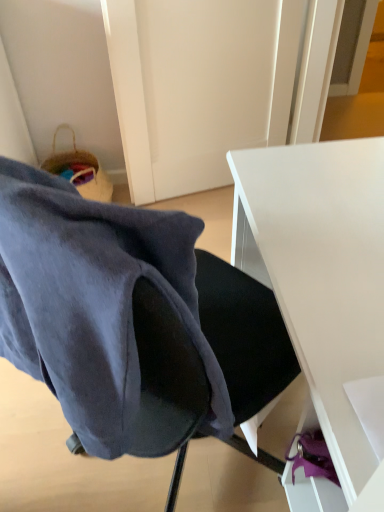
Question: Relative to white matte desk at center, is velvet dark blue chair at center in front or behind?

Choices:
 (A) behind
 (B) front

Answer: (B)

Question: Considering the positions of velvet dark blue chair at center and white matte desk at center in the image, is velvet dark blue chair at center taller or shorter than white matte desk at center?

Choices:
 (A) short
 (B) tall

Answer: (A)

Question: Which is correct: velvet dark blue chair at center is inside white matte desk at center, or outside of it?

Choices:
 (A) inside
 (B) outside

Answer: (B)

Question: Do you think white matte desk at center is within velvet dark blue chair at center, or outside of it?

Choices:
 (A) inside
 (B) outside

Answer: (B)

Question: In terms of height, does white matte desk at center look taller or shorter compared to velvet dark blue chair at center?

Choices:
 (A) short
 (B) tall

Answer: (B)

Question: Considering the positions of point (321, 152) and point (84, 400), is point (321, 152) closer or farther from the camera than point (84, 400)?

Choices:
 (A) farther
 (B) closer

Answer: (A)

Question: Considering the positions of white matte desk at center and velvet dark blue chair at center in the image, is white matte desk at center wider or thinner than velvet dark blue chair at center?

Choices:
 (A) thin
 (B) wide

Answer: (B)